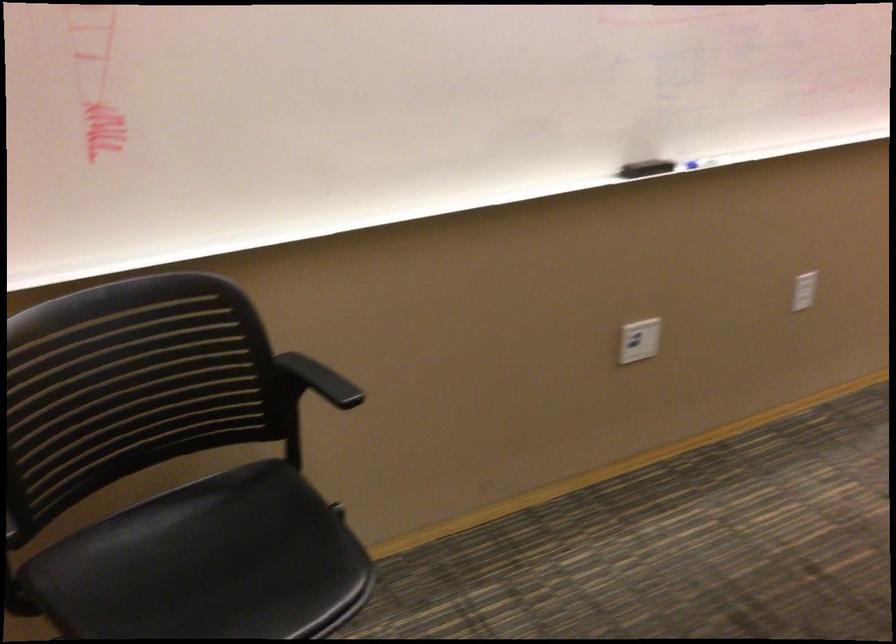
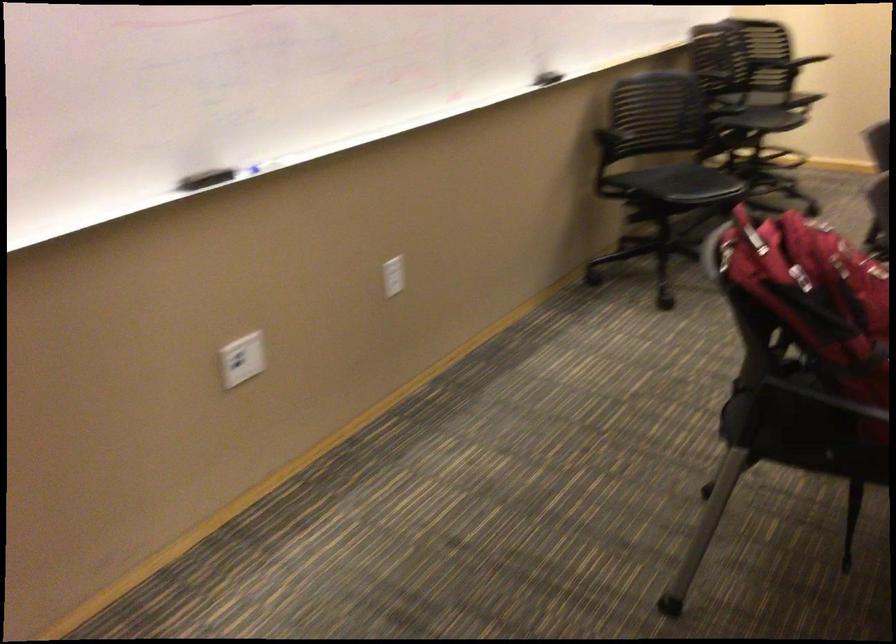
Locate, in the second image, the point that corresponds to pixel 645 165 in the first image.

(204, 178)